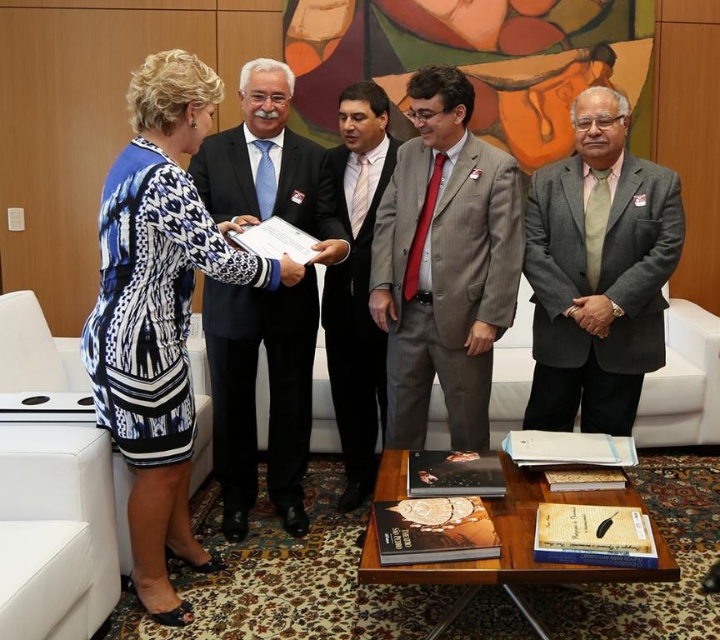
You are an event planner organizing a photoshoot for a corporate event. You need to position the blue printed dress at left and the gray pinstripe suit at center in a way that maintains their original spatial relationship from the scene. If you want to place both subjects on the right side of the frame, where should each be positioned relative to each other?

To maintain their original spatial relationship, the blue printed dress at left should be positioned to the left of the gray pinstripe suit at center when placed on the right side of the frame.

You are a photographer trying to capture the man in the gray wool suit at right. The camera you are using has a focus point at coordinate point (598, 273). Will this point be sufficient to focus on the gray wool suit at right?

The point (598, 273) is on the gray wool suit at right, so yes, the focus point will be sufficient to focus on the gray wool suit at right.

You are an event planner arranging seating for a conference. You need to place the blue printed dress at left and the gray pinstripe suit at center in a row. Considering their heights, which one should be placed in the front row to ensure visibility?

The blue printed dress at left should be placed in the front row because it has a greater height compared to the gray pinstripe suit at center, ensuring better visibility.